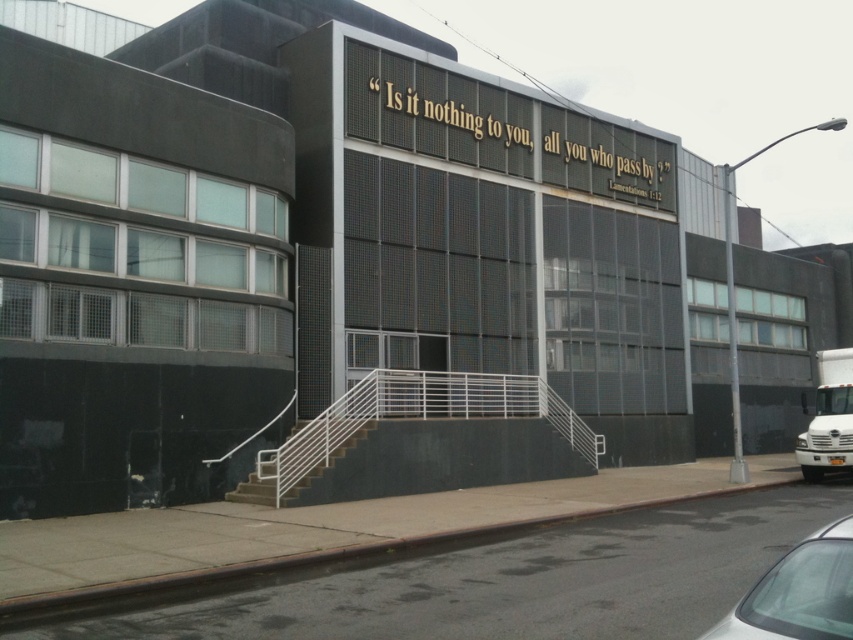
You are a pedestrian standing at the entrance of the modern building and want to hail a taxi. You see a silver metallic car at lower right and concrete stairs at center. Which object is closer to you?

The silver metallic car at lower right is in front of the concrete stairs at center, so it is closer to you.

You are a pedestrian standing at the entrance of the modern building. You see a silver metallic car at lower right and concrete stairs at center. Which object is positioned higher relative to the other?

The silver metallic car at lower right is positioned higher than the concrete stairs at center.